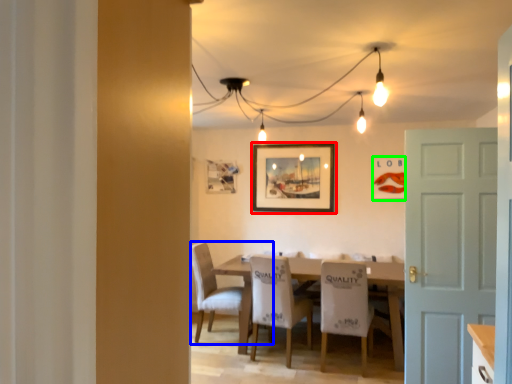
Question: Which object is positioned farthest from picture frame (highlighted by a red box)? Select from chair (highlighted by a blue box) and picture frame (highlighted by a green box).

Choices:
 (A) chair
 (B) picture frame

Answer: (A)